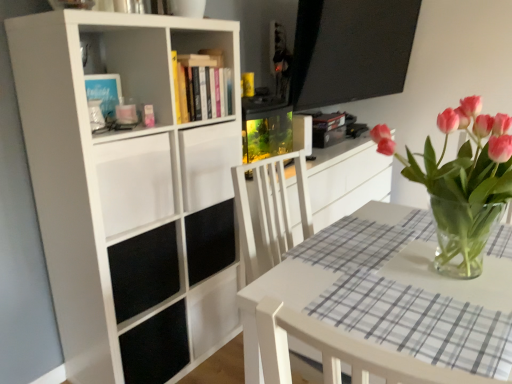
This screenshot has width=512, height=384. What are the coordinates of `vacant space behind white wood chair at lower right` in the screenshot? It's located at (408, 273).